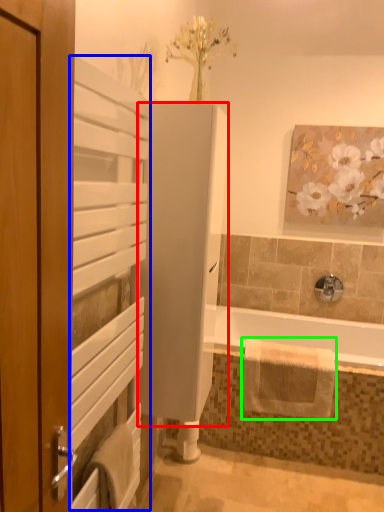
Question: Which is nearer to the screen door (highlighted by a red box)? screen door (highlighted by a blue box) or bath towel (highlighted by a green box).

Choices:
 (A) screen door
 (B) bath towel

Answer: (A)